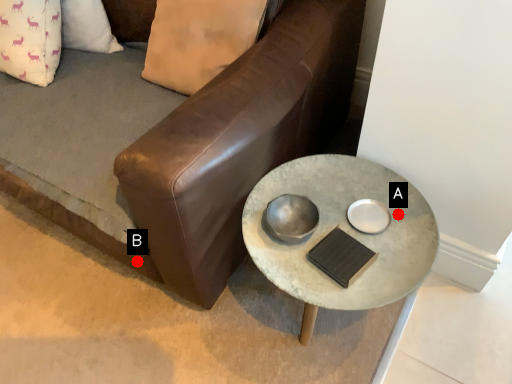
Question: Two points are circled on the image, labeled by A and B beside each circle. Which point is closer to the camera?

Choices:
 (A) A is closer
 (B) B is closer

Answer: (A)